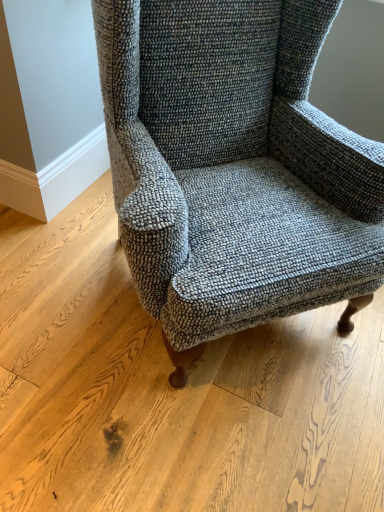
You are a GUI agent. You are given a task and a screenshot of the screen. Output one action in this format:
    pyautogui.click(x=<x>, y=<y>)
    Task: Click on the vacant space situated on the left part of textured gray fabric chair at center
    
    Given the screenshot: What is the action you would take?
    pyautogui.click(x=58, y=282)